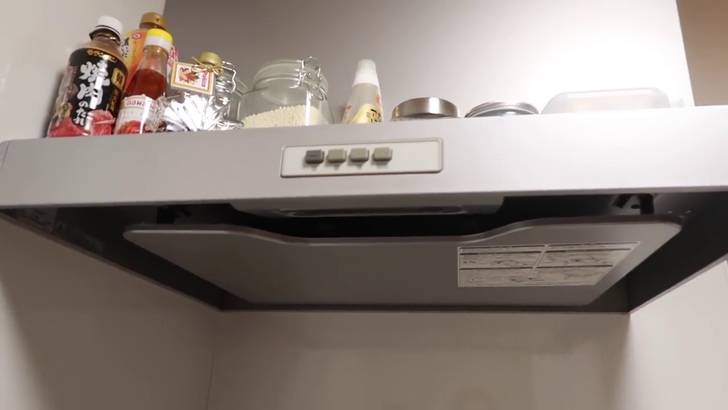
Where is `platic container`? platic container is located at coordinates pos(617,99).